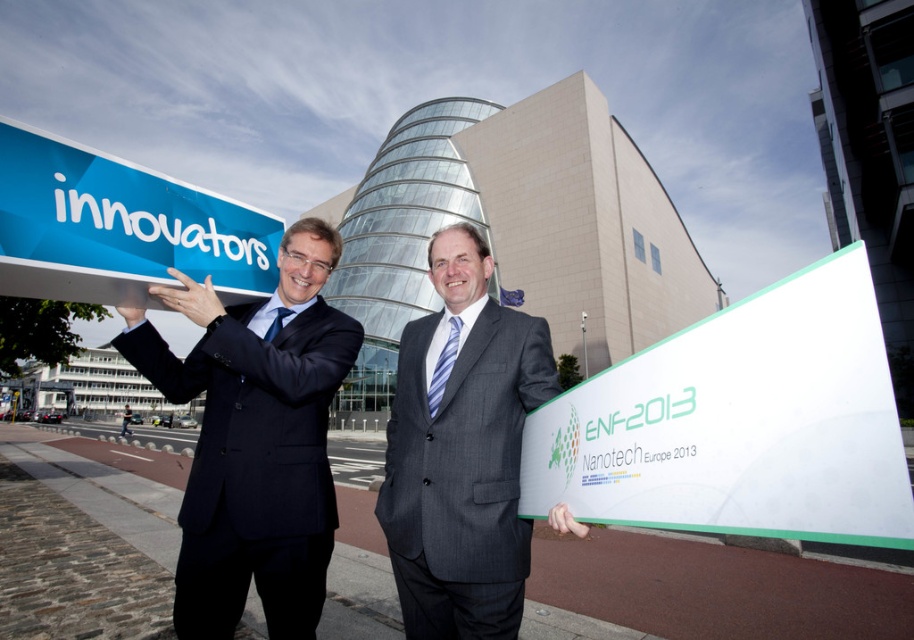
Does white plastic sign at center come in front of gray suit at center?

Yes.

Who is shorter, white plastic sign at center or gray suit at center?

With less height is white plastic sign at center.

Identify the location of white plastic sign at center. [x=739, y=422].

Does white plastic sign at center have a lesser width compared to dark blue suit at left?

Yes.

Between point (647, 452) and point (218, 577), which one is positioned in front?

Point (647, 452) is more forward.

Find the location of a particular element. This screenshot has width=914, height=640. white plastic sign at center is located at coordinates (739, 422).

Who is taller, white plastic sign at center or blue plastic sign at upper left?

With more height is white plastic sign at center.

Does white plastic sign at center have a lesser width compared to blue plastic sign at upper left?

No, white plastic sign at center is not thinner than blue plastic sign at upper left.

Is point (533, 429) farther from camera compared to point (52, 266)?

Yes, point (533, 429) is farther from viewer.

Identify the location of white plastic sign at center. Image resolution: width=914 pixels, height=640 pixels. (x=739, y=422).